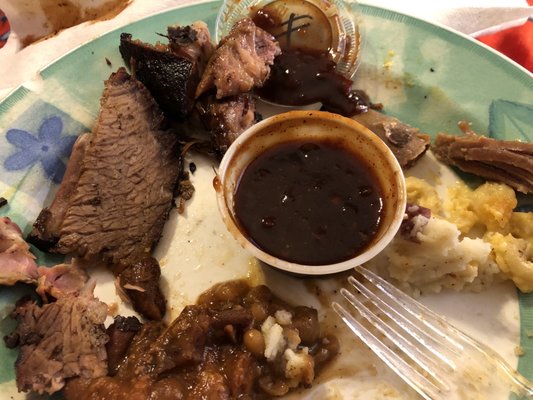
The height and width of the screenshot is (400, 533). Find the location of `ceramic plate`. ceramic plate is located at coordinates (36, 183), (198, 247), (422, 62).